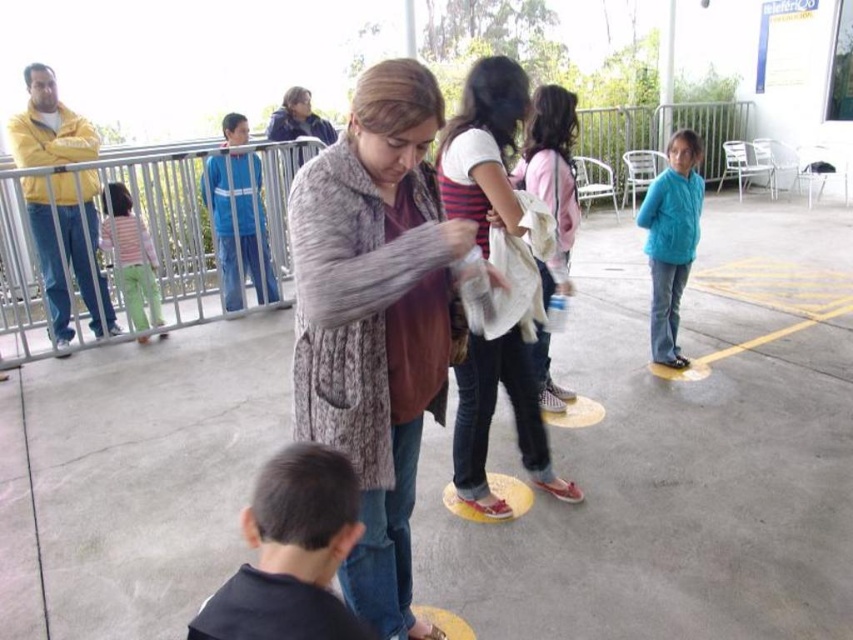
Question: Among these objects, which one is farthest from the camera?

Choices:
 (A) dark blue fabric at lower left
 (B) yellow painted line at lower right
 (C) teal fleece jacket at right

Answer: (B)

Question: Which is nearer to the white cotton backpack at center?

Choices:
 (A) striped knit sweater at center
 (B) light pink fabric pants at left
 (C) teal fleece jacket at right

Answer: (A)

Question: Is dark blue fabric at lower left in front of yellow painted line at lower right?

Choices:
 (A) yes
 (B) no

Answer: (A)

Question: Among these objects, which one is nearest to the camera?

Choices:
 (A) knitted gray scarf at center
 (B) striped knit sweater at center
 (C) light pink fabric pants at left

Answer: (A)

Question: Is metallic silver railing at left to the left of white cotton backpack at center from the viewer's perspective?

Choices:
 (A) yes
 (B) no

Answer: (A)

Question: Is striped knit sweater at center behind teal fleece jacket at right?

Choices:
 (A) yes
 (B) no

Answer: (B)